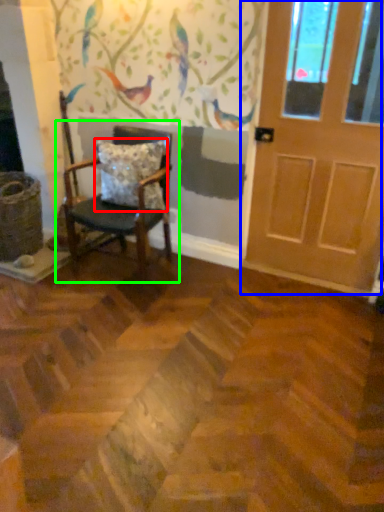
Question: Which is farther away from pillow (highlighted by a red box)? door (highlighted by a blue box) or chair (highlighted by a green box)?

Choices:
 (A) door
 (B) chair

Answer: (A)